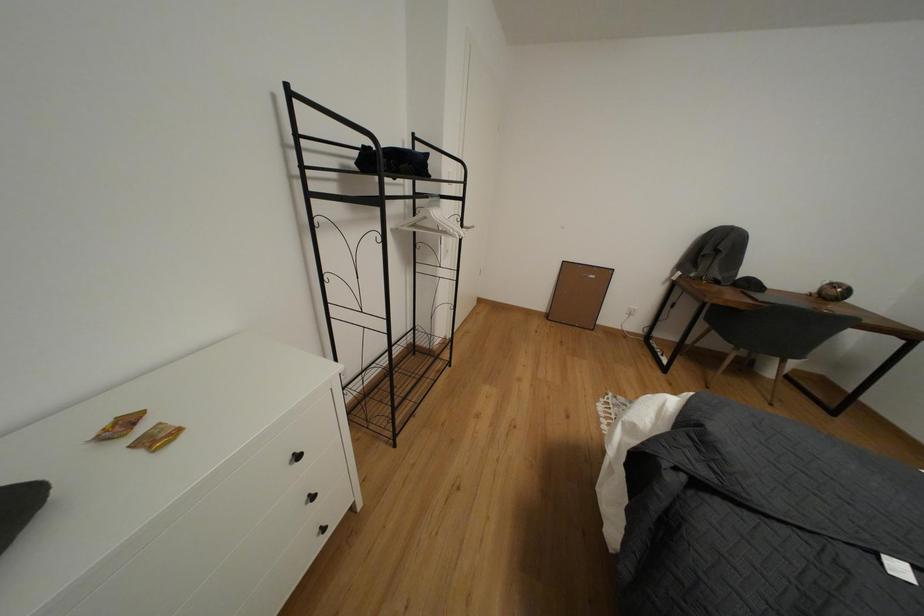
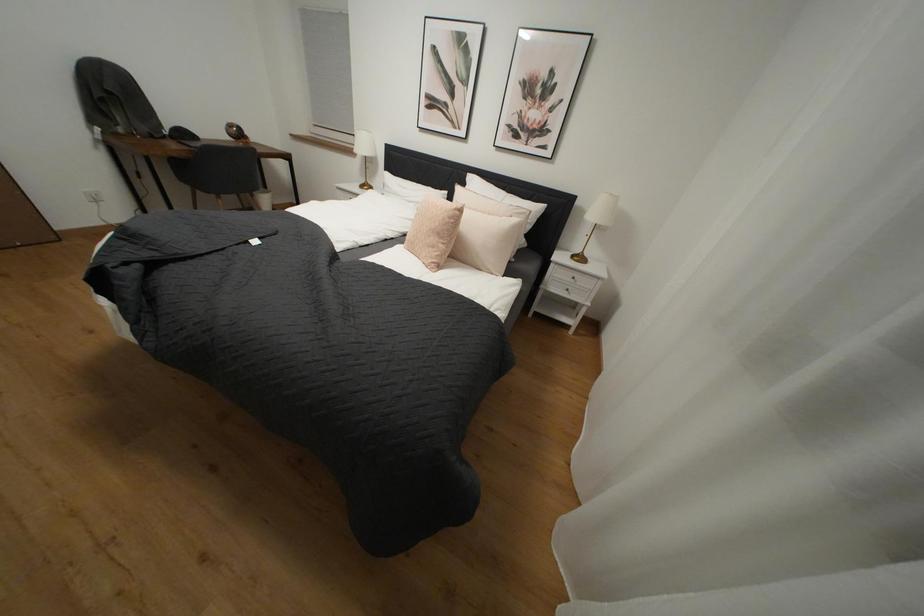
Looking at this image, the images are taken continuously from a first-person perspective. In which direction is your viewpoint rotating?

The camera's rotation is toward right-down.